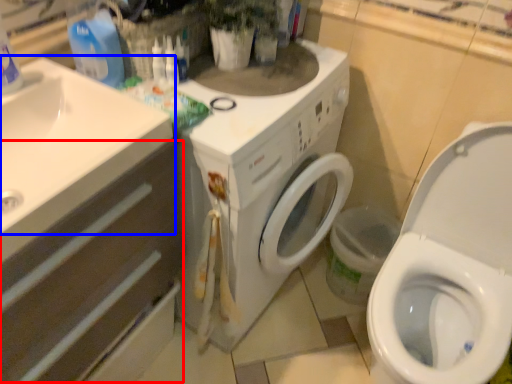
Question: Which point is closer to the camera, drawer (highlighted by a red box) or sink (highlighted by a blue box)?

Choices:
 (A) drawer
 (B) sink

Answer: (A)